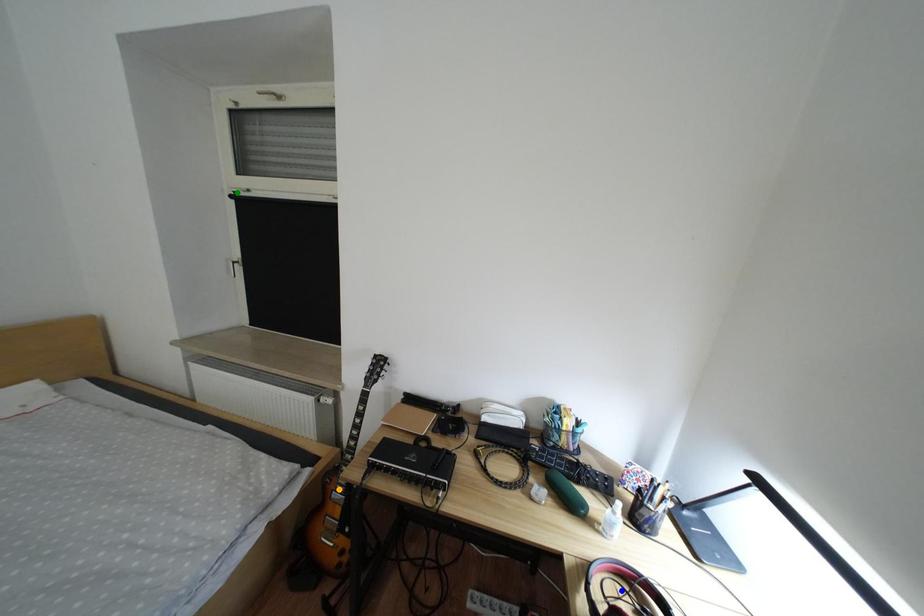
Order these from nearest to farthest:
A) orange point
B) green point
C) blue point

green point
orange point
blue point